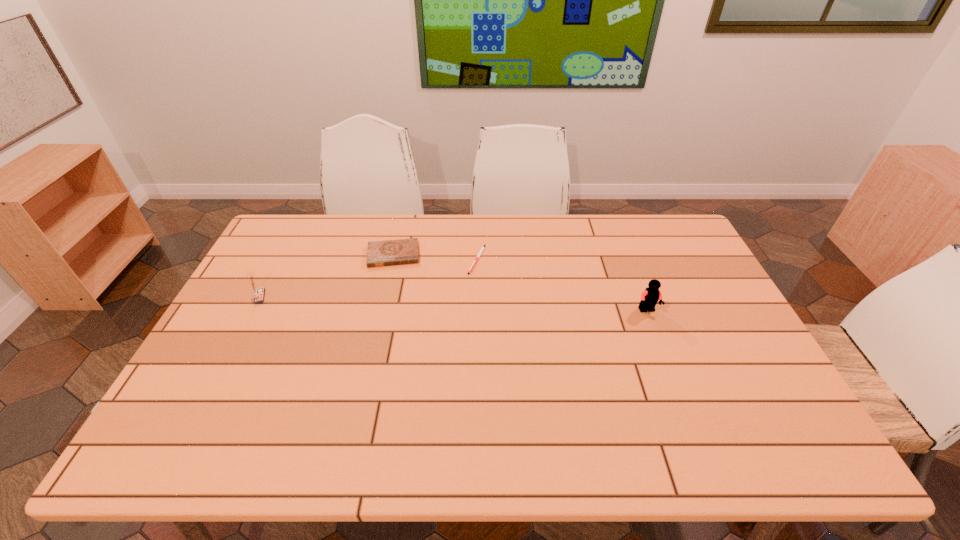
Where is `vacant space on the desktop that is between the matchbox and the Lego and is positioned on the clicker of the shortest object`? This screenshot has height=540, width=960. vacant space on the desktop that is between the matchbox and the Lego and is positioned on the clicker of the shortest object is located at coordinates (491, 305).

This screenshot has height=540, width=960. What are the coordinates of `vacant space on the desktop that is between the third farthest object and the rightmost object and is positioned on the spine side of the diary` in the screenshot? It's located at (393, 301).